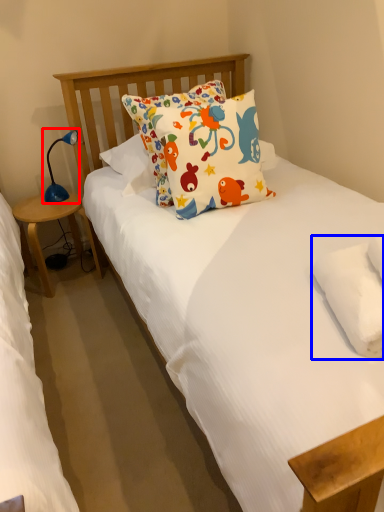
Question: Which object appears closest to the camera in this image, table lamp (highlighted by a red box) or pillow (highlighted by a blue box)?

Choices:
 (A) table lamp
 (B) pillow

Answer: (B)